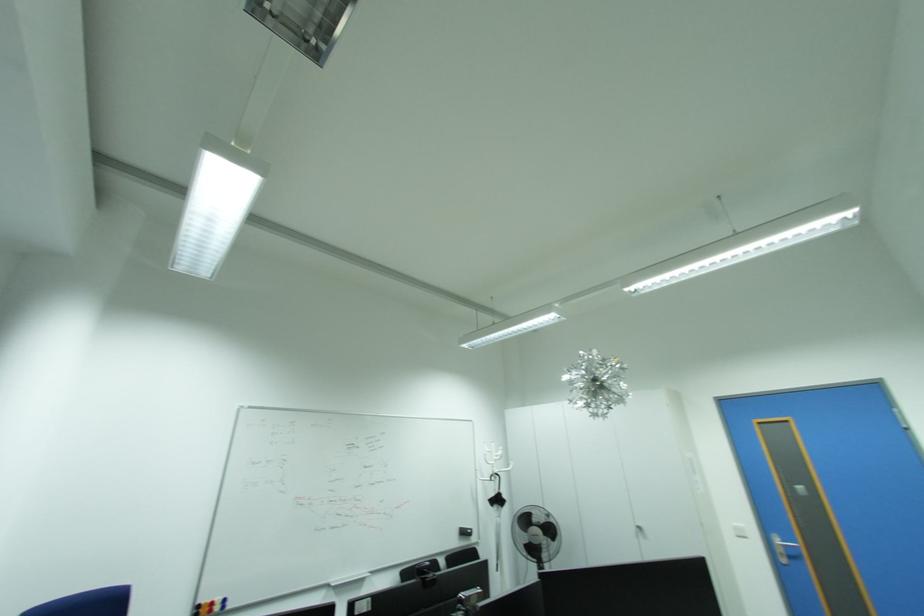
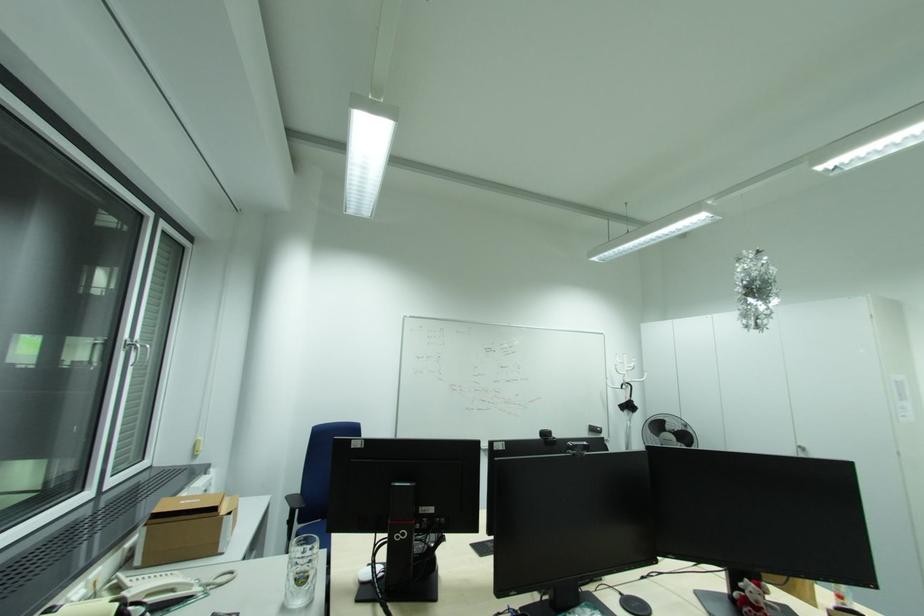
Question: The first image is from the beginning of the video and the second image is from the end. How did the camera likely rotate when shooting the video?

Choices:
 (A) Left
 (B) Right
 (C) Up
 (D) Down

Answer: (A)